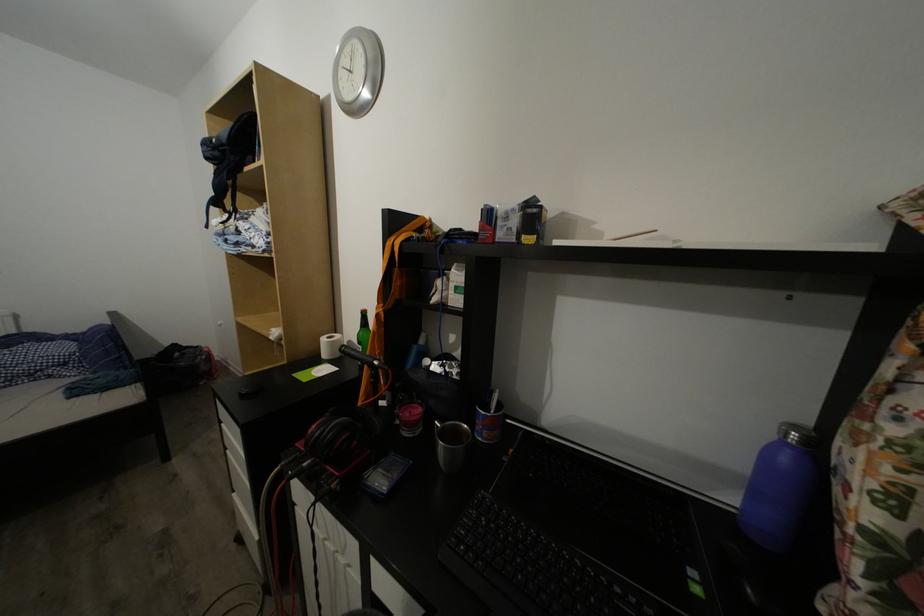
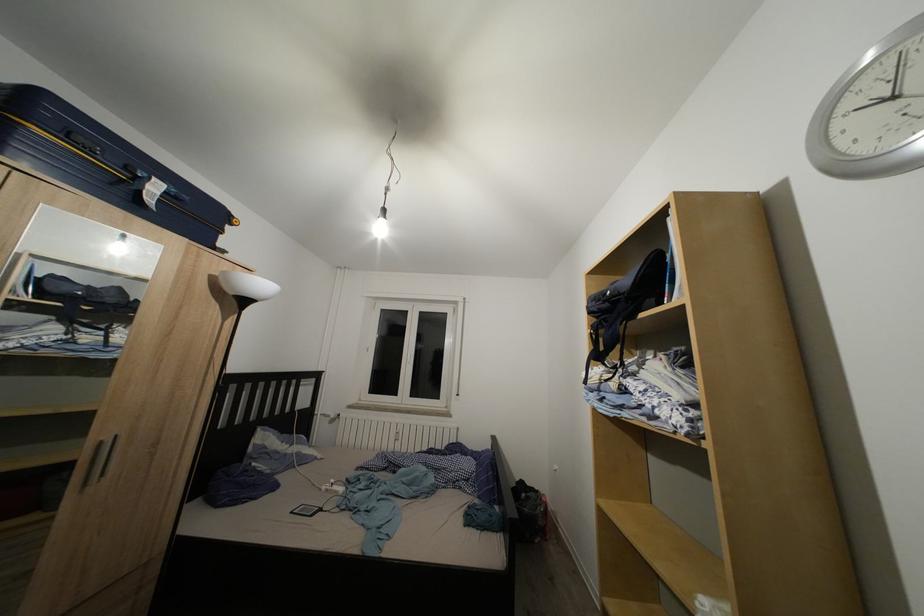
Where in the second image is the point corresponding to the point at 216,161 from the first image?

(602, 315)